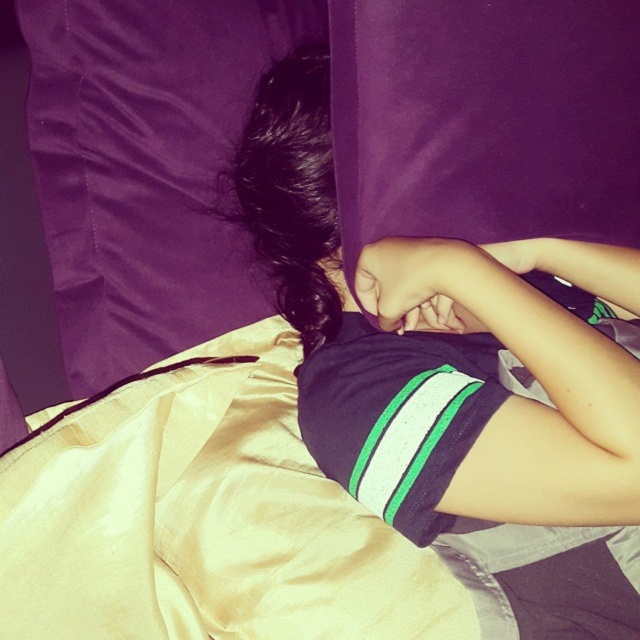
You are standing in front of the scene and want to touch both points. Which point, point (x=212, y=531) or point (x=257, y=0), will require you to reach further out?

Point (x=257, y=0) will require you to reach further out because it is farther from the viewer compared to point (x=212, y=531).

You are standing in front of the image and want to know how far the point at coordinates point [131,404] is from you. Can you determine the distance?

The point at coordinates point [131,404] is 65.92 centimeters away from the viewer.